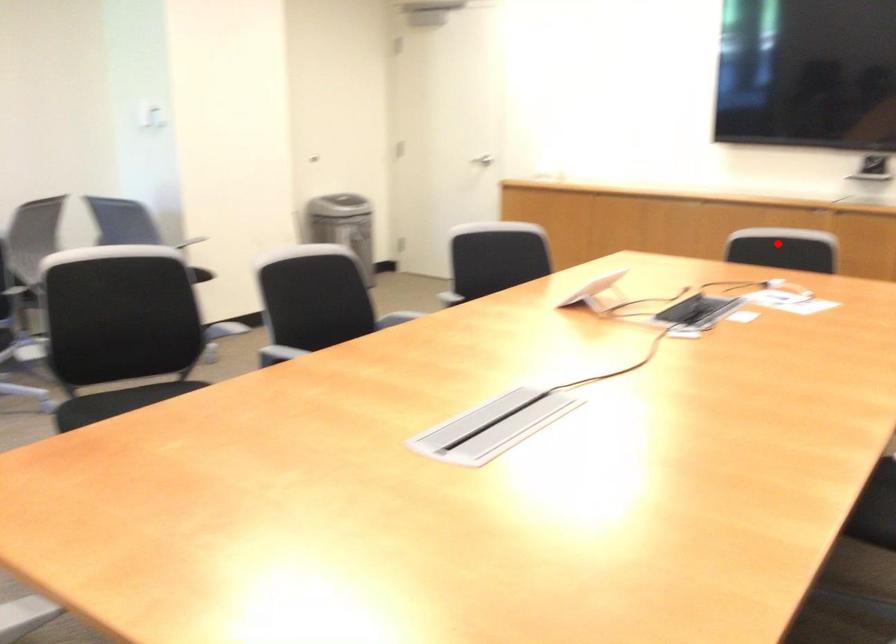
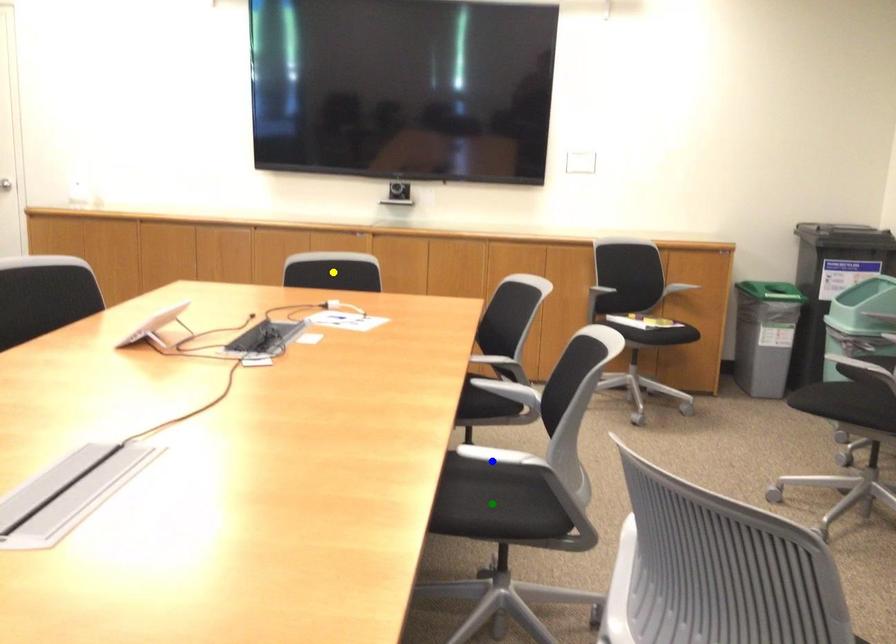
Question: I am providing you with two images of the same scene from different viewpoints. A red point is marked on the first image. You are given multiple points on the second image. Which spot in image 2 lines up with the point in image 1?

Choices:
 (A) blue point
 (B) green point
 (C) yellow point

Answer: (C)